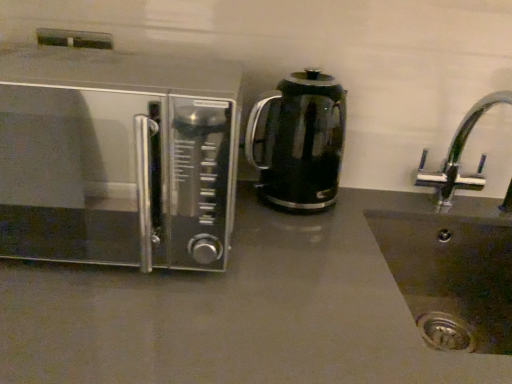
Question: From a real-world perspective, is black glass kettle at center physically below satin silver microwave at left?

Choices:
 (A) yes
 (B) no

Answer: (A)

Question: Is black glass kettle at center next to satin silver microwave at left?

Choices:
 (A) no
 (B) yes

Answer: (A)

Question: From the image's perspective, would you say black glass kettle at center is shown under satin silver microwave at left?

Choices:
 (A) yes
 (B) no

Answer: (B)

Question: Can you confirm if black glass kettle at center is shorter than satin silver microwave at left?

Choices:
 (A) no
 (B) yes

Answer: (B)

Question: Is black glass kettle at center to the right of satin silver microwave at left from the viewer's perspective?

Choices:
 (A) no
 (B) yes

Answer: (B)

Question: Is black glass kettle at center far away from satin silver microwave at left?

Choices:
 (A) no
 (B) yes

Answer: (A)

Question: Is matte gray countertop at center positioned in front of chrome metallic faucet at right?

Choices:
 (A) no
 (B) yes

Answer: (B)

Question: Considering the relative sizes of matte gray countertop at center and chrome metallic faucet at right in the image provided, is matte gray countertop at center taller than chrome metallic faucet at right?

Choices:
 (A) yes
 (B) no

Answer: (A)

Question: Is the surface of matte gray countertop at center in direct contact with chrome metallic faucet at right?

Choices:
 (A) yes
 (B) no

Answer: (B)

Question: Would you say matte gray countertop at center is a long distance from chrome metallic faucet at right?

Choices:
 (A) yes
 (B) no

Answer: (B)

Question: Does matte gray countertop at center have a lesser height compared to chrome metallic faucet at right?

Choices:
 (A) yes
 (B) no

Answer: (B)

Question: Is chrome metallic faucet at right completely or partially inside matte gray countertop at center?

Choices:
 (A) yes
 (B) no

Answer: (B)

Question: Can you confirm if chrome metallic faucet at right is thinner than matte gray countertop at center?

Choices:
 (A) no
 (B) yes

Answer: (B)